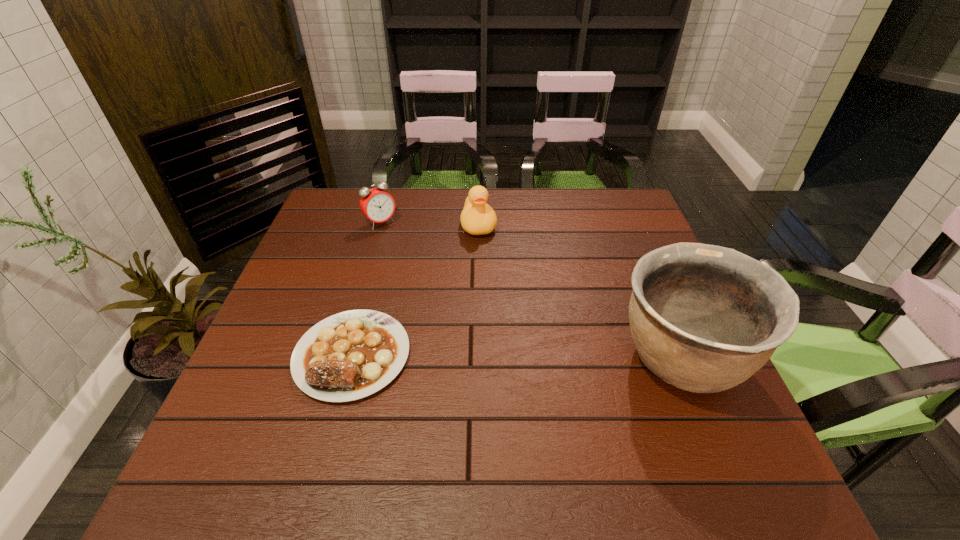
Locate which object ranks third in proximity to the rightmost object. Please provide its 2D coordinates. Your answer should be formatted as a tuple, i.e. [(x, y)], where the tuple contains the x and y coordinates of a point satisfying the conditions above.

[(376, 204)]

The image size is (960, 540). In order to click on object that stands as the closest to the alarm clock in this screenshot , I will do pyautogui.click(x=477, y=218).

Image resolution: width=960 pixels, height=540 pixels. In order to click on vacant area that satisfies the following two spatial constraints: 1. on the front side of the duck; 2. on the right side of the alarm clock in this screenshot , I will do `click(380, 225)`.

Locate an element on the screen. The width and height of the screenshot is (960, 540). vacant space that satisfies the following two spatial constraints: 1. on the back side of the shortest object; 2. on the right side of the duck is located at coordinates (387, 225).

The image size is (960, 540). Identify the location of vacant space that satisfies the following two spatial constraints: 1. on the back side of the steak; 2. on the left side of the duck. (387, 225).

The height and width of the screenshot is (540, 960). What are the coordinates of `vacant region that satisfies the following two spatial constraints: 1. on the front side of the second object from right to left; 2. on the right side of the tallest object` in the screenshot? It's located at tap(478, 360).

Locate an element on the screen. free space that satisfies the following two spatial constraints: 1. on the front side of the second object from right to left; 2. on the left side of the tallest object is located at coordinates coord(478,360).

Where is `free space that satisfies the following two spatial constraints: 1. on the front side of the alarm clock; 2. on the left side of the shortest object`? The height and width of the screenshot is (540, 960). free space that satisfies the following two spatial constraints: 1. on the front side of the alarm clock; 2. on the left side of the shortest object is located at coordinates (343, 355).